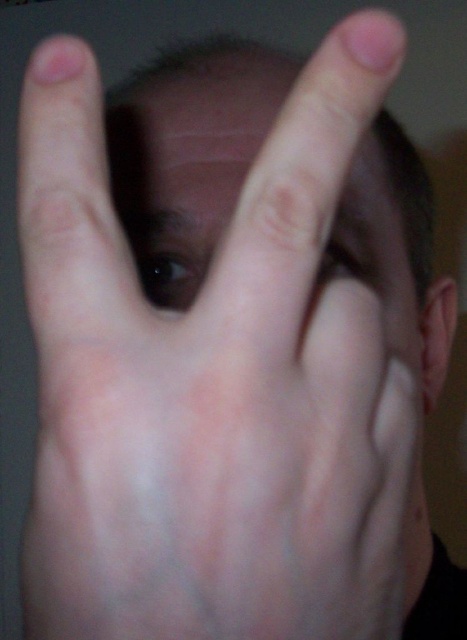
You are an artist trying to paint the scene. You notice two eyes in the image, the black glossy eye at center and the matte skin eye at center. Which eye takes up more space in the image?

The matte skin eye at center takes up more space than the black glossy eye at center.

You are a photographer adjusting the lighting in a dimly lit room. You notice two eyes in the image, the black glossy eye at center and the matte skin eye at center. Which eye appears shorter in height?

The black glossy eye at center is not as tall as the matte skin eye at center, so the black glossy eye at center appears shorter in height.